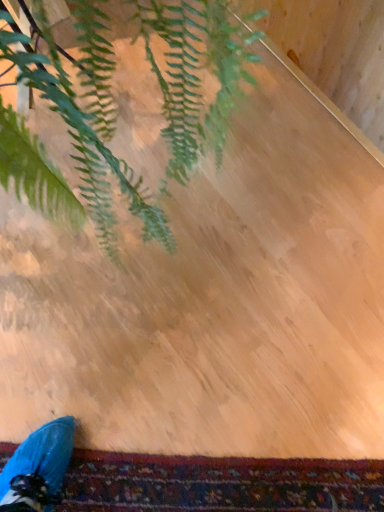
What are the coordinates of `free spot below green leafy plant at upper left (from a real-world perspective)` in the screenshot? It's located at (83, 228).